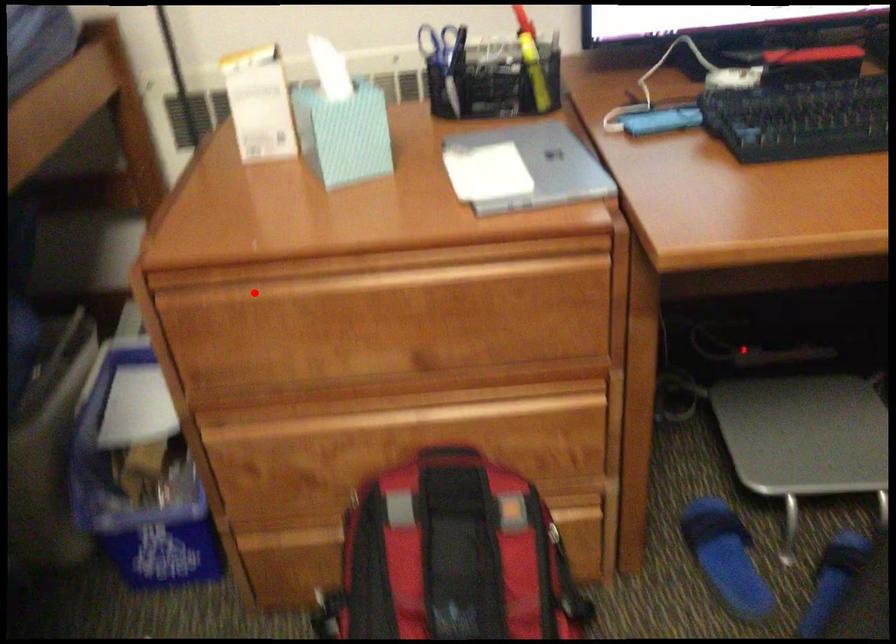
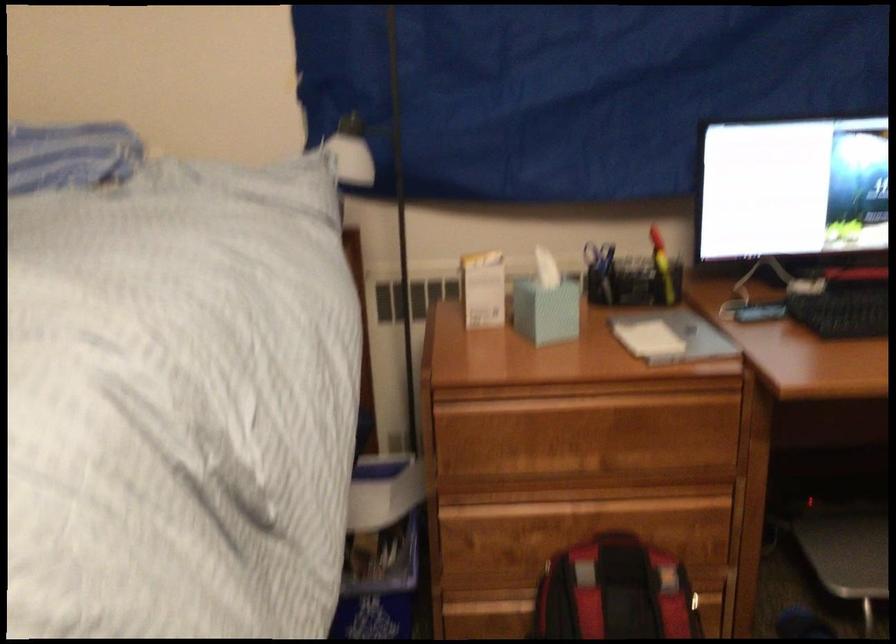
Locate, in the second image, the point that corresponds to the highlighted location in the first image.

(497, 406)